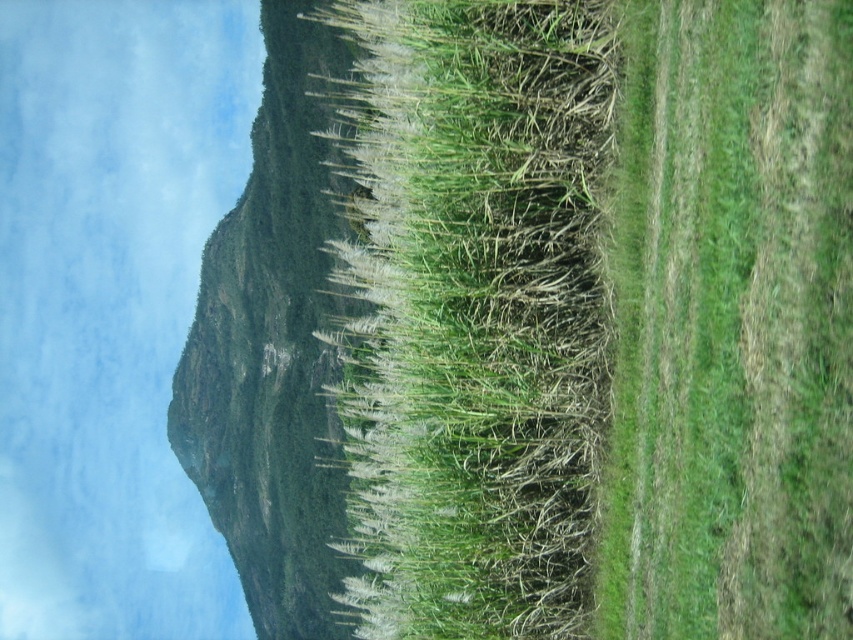
Looking at this image, you are a farmer checking the field. You see two green grassy areas labeled as green grassy at center and green grassy at right. Which area requires more water based on their sizes?

The green grassy at center requires more water because it is larger in size than the green grassy at right.

You are standing at the bottom right corner of the image, looking towards the center. There is a dirt path running towards the center and a green grassy area at center. Which direction should you walk to reach the green grassy at center first?

To reach the green grassy at center first, walk along the dirt path towards the center since it is the direct route leading towards that area.